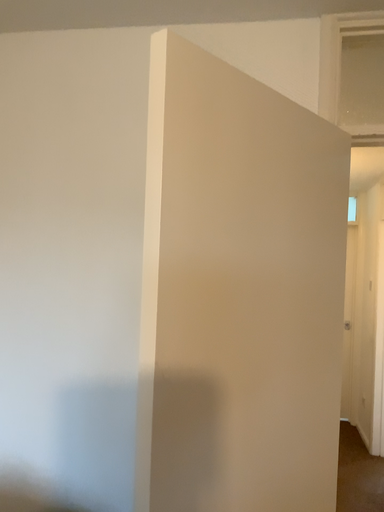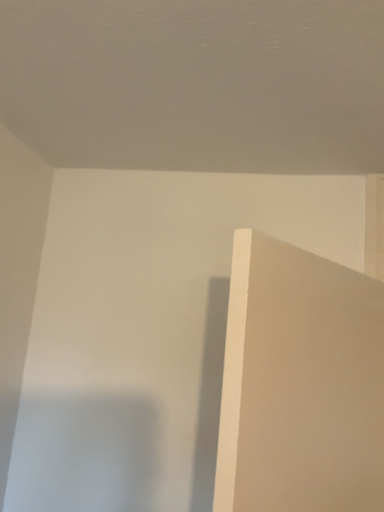
Question: Which way did the camera rotate in the video?

Choices:
 (A) rotated upward
 (B) rotated downward

Answer: (A)